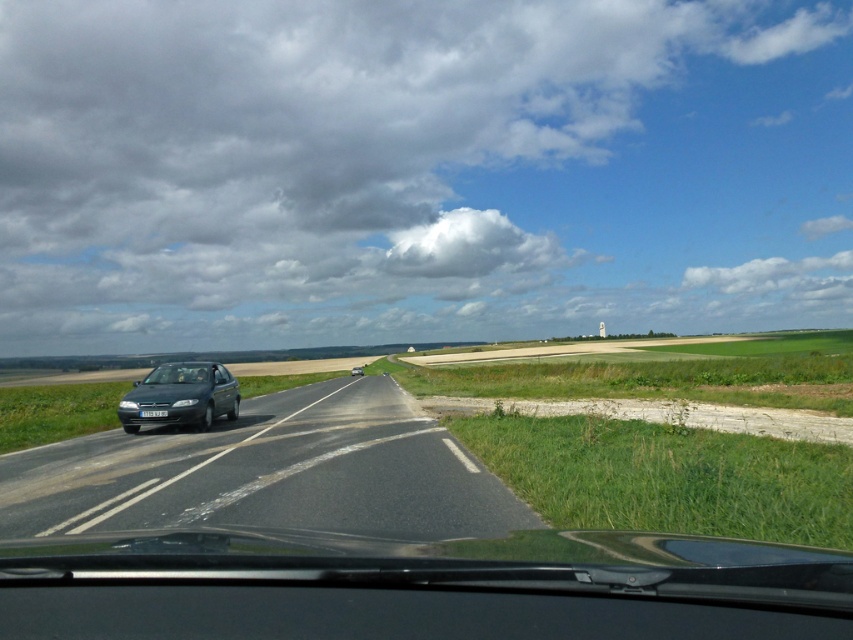
Does shiny black car at left appear on the left side of satin black car at left?

No, shiny black car at left is not to the left of satin black car at left.

Does point (76, 502) come closer to viewer compared to point (155, 397)?

Yes, it is in front of point (155, 397).

This screenshot has width=853, height=640. I want to click on shiny black car at left, so click(267, 474).

Locate an element on the screen. The image size is (853, 640). satin black car at left is located at coordinates click(180, 396).

Can you confirm if shiny black car at left is shorter than transparent glass windshield at center?

No, shiny black car at left is not shorter than transparent glass windshield at center.

Which of these two, shiny black car at left or transparent glass windshield at center, stands shorter?

With less height is transparent glass windshield at center.

Between point (256, 433) and point (201, 380), which one is positioned in front?

Point (256, 433) is in front.

This screenshot has height=640, width=853. In order to click on shiny black car at left in this screenshot , I will do `click(267, 474)`.